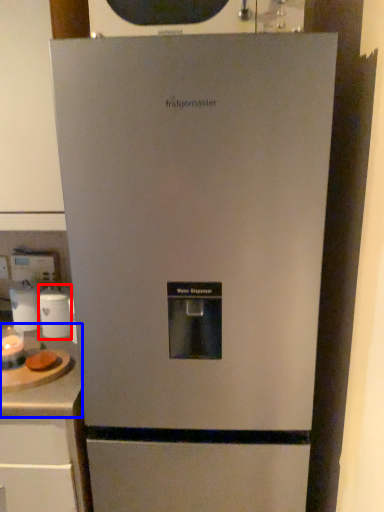
Question: Which point is closer to the camera, appliance (highlighted by a red box) or counter top (highlighted by a blue box)?

Choices:
 (A) appliance
 (B) counter top

Answer: (B)